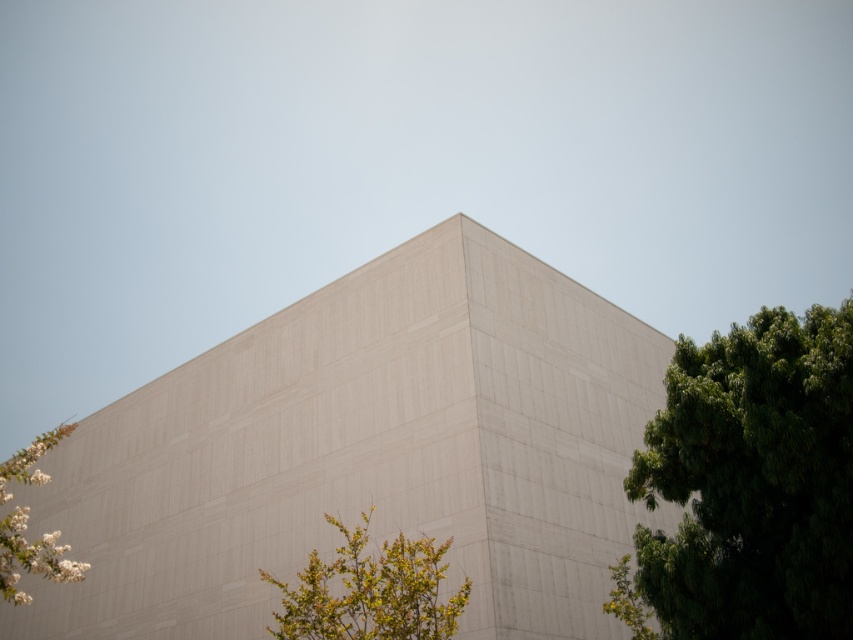
Consider the image. You are standing in front of the modern building and want to take a photo of both the green leafy bush at lower center and the white textured flowers at lower left. Based on their positions, which one should you adjust your camera angle to include first without moving your position?

The green leafy bush at lower center is located below the white textured flowers at lower left. To include both in the photo without moving, you should first adjust your camera angle downward to capture the green leafy bush at lower center, then angle slightly upward to include the white textured flowers at lower left.